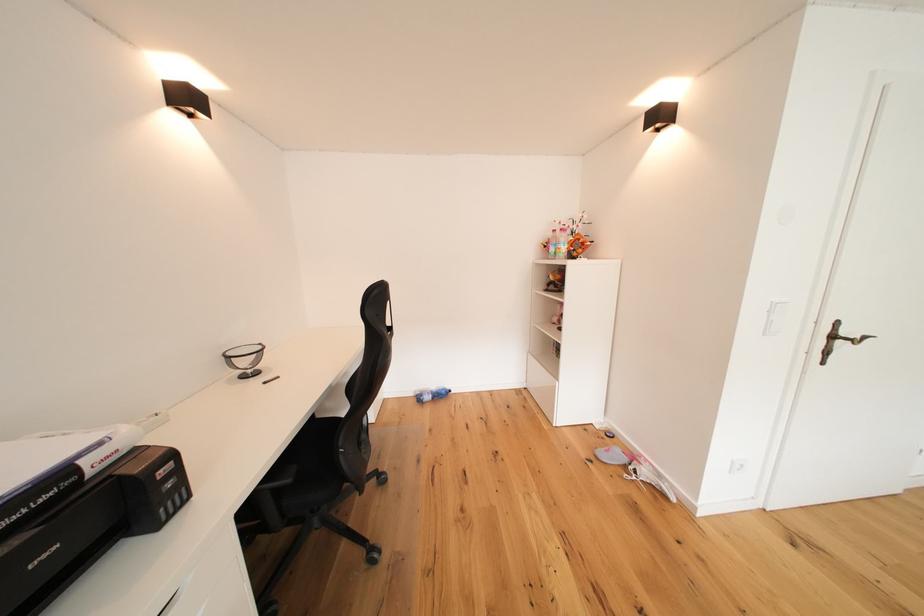
Where is `dark door handle`? This screenshot has height=616, width=924. dark door handle is located at coordinates (845, 334).